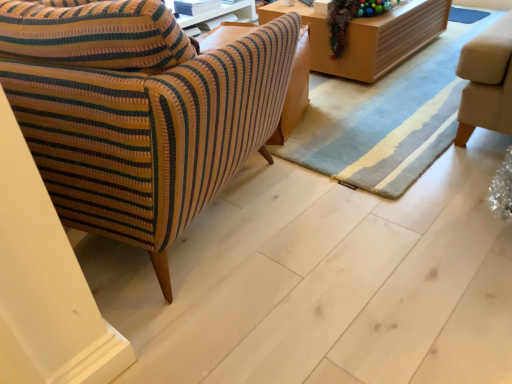
Question: From the image's perspective, would you say shiny metallic garland at upper right is shown under wooden table at upper center?

Choices:
 (A) yes
 (B) no

Answer: (A)

Question: Can you confirm if shiny metallic garland at upper right is positioned to the right of wooden table at upper center?

Choices:
 (A) yes
 (B) no

Answer: (B)

Question: Is there a large distance between shiny metallic garland at upper right and wooden table at upper center?

Choices:
 (A) yes
 (B) no

Answer: (B)

Question: Can we say shiny metallic garland at upper right lies outside wooden table at upper center?

Choices:
 (A) yes
 (B) no

Answer: (B)

Question: Does shiny metallic garland at upper right have a lesser width compared to wooden table at upper center?

Choices:
 (A) no
 (B) yes

Answer: (B)

Question: From the image's perspective, is wooden table at upper center above or below striped fabric armchair at left?

Choices:
 (A) above
 (B) below

Answer: (A)

Question: In terms of height, does wooden table at upper center look taller or shorter compared to striped fabric armchair at left?

Choices:
 (A) short
 (B) tall

Answer: (A)

Question: From a real-world perspective, is wooden table at upper center physically located above or below striped fabric armchair at left?

Choices:
 (A) below
 (B) above

Answer: (A)

Question: Is point pos(354,77) positioned closer to the camera than point pos(174,114)?

Choices:
 (A) farther
 (B) closer

Answer: (A)

Question: Is striped fabric armchair at left inside the boundaries of wooden table at upper center, or outside?

Choices:
 (A) outside
 (B) inside

Answer: (A)

Question: Based on their sizes in the image, would you say striped fabric armchair at left is bigger or smaller than wooden table at upper center?

Choices:
 (A) big
 (B) small

Answer: (A)

Question: From the image's perspective, is striped fabric armchair at left above or below wooden table at upper center?

Choices:
 (A) below
 (B) above

Answer: (A)

Question: Considering the positions of striped fabric armchair at left and wooden table at upper center in the image, is striped fabric armchair at left taller or shorter than wooden table at upper center?

Choices:
 (A) tall
 (B) short

Answer: (A)

Question: Is shiny metallic garland at upper right taller or shorter than striped fabric armchair at left?

Choices:
 (A) short
 (B) tall

Answer: (A)

Question: Based on their positions, is shiny metallic garland at upper right located to the left or right of striped fabric armchair at left?

Choices:
 (A) right
 (B) left

Answer: (A)